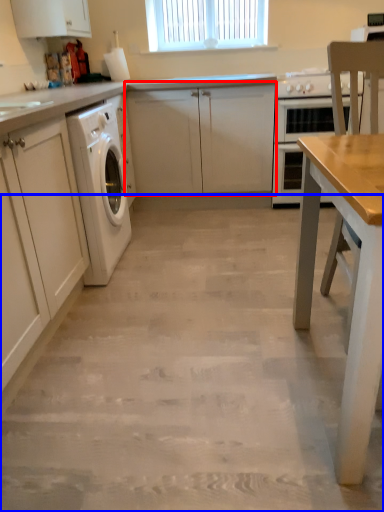
Question: Which point is closer to the camera, cabinetry (highlighted by a red box) or concrete (highlighted by a blue box)?

Choices:
 (A) cabinetry
 (B) concrete

Answer: (B)